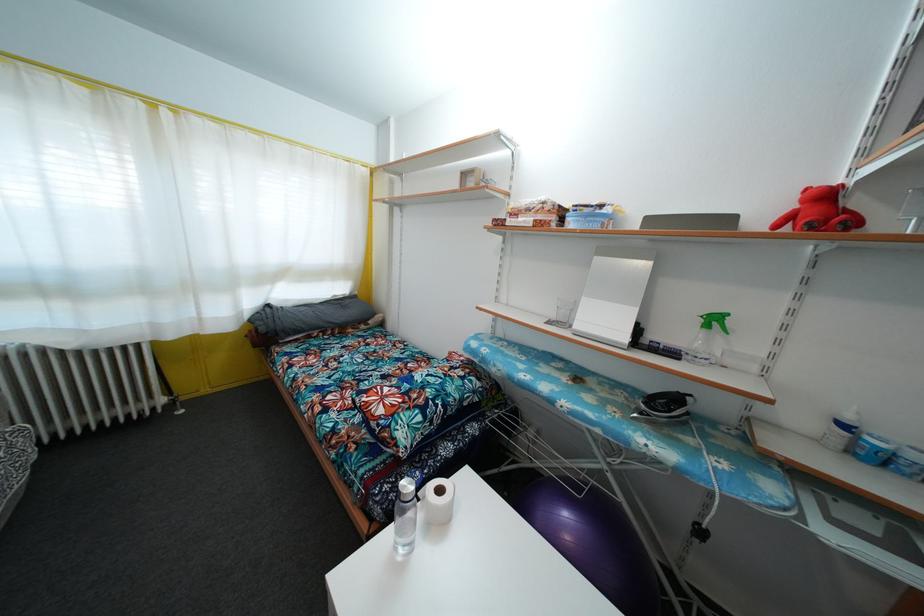
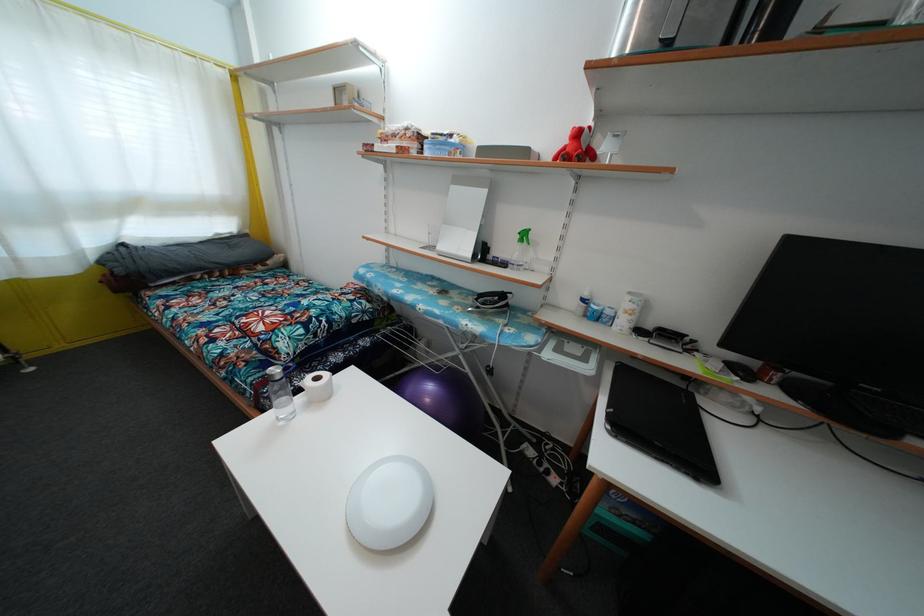
Find the pixel in the second image that matches point 643,248 in the first image.

(488, 177)